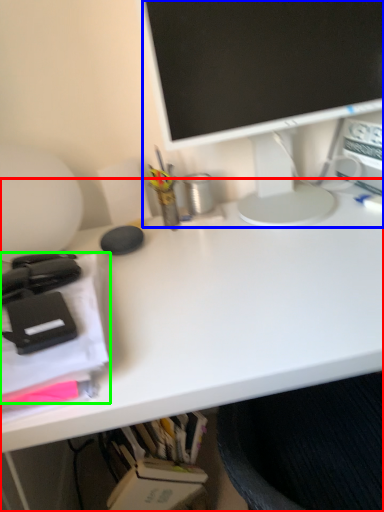
Question: Which object is positioned closest to desk (highlighted by a red box)? Select from television (highlighted by a blue box) and office supplies (highlighted by a green box).

Choices:
 (A) television
 (B) office supplies

Answer: (B)